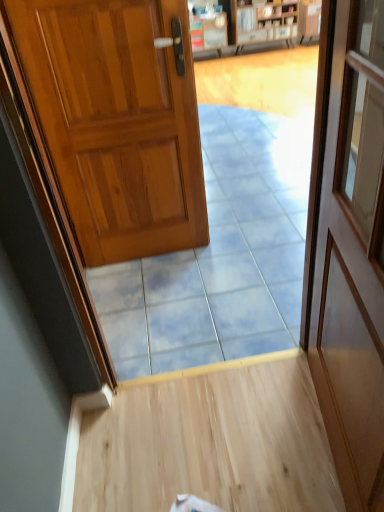
Question: Should I look upward or downward to see blue glossy tile at center?

Choices:
 (A) down
 (B) up

Answer: (A)

Question: Is wooden door at right, marked as the 2th door in a back-to-front arrangement, positioned far away from shiny wood door at left, positioned as the second door in right-to-left order?

Choices:
 (A) yes
 (B) no

Answer: (A)

Question: Does wooden door at right, the 2th door viewed from the left, have a smaller size compared to shiny wood door at left, positioned as the 1th door in back-to-front order?

Choices:
 (A) no
 (B) yes

Answer: (A)

Question: From a real-world perspective, is wooden door at right, marked as the 2th door in a back-to-front arrangement, located beneath shiny wood door at left, the first door viewed from the left?

Choices:
 (A) yes
 (B) no

Answer: (B)

Question: Considering the relative sizes of wooden door at right, which appears as the first door when viewed from the right, and shiny wood door at left, positioned as the second door in right-to-left order, in the image provided, is wooden door at right, which appears as the first door when viewed from the right, bigger than shiny wood door at left, positioned as the second door in right-to-left order,?

Choices:
 (A) no
 (B) yes

Answer: (B)

Question: Does wooden door at right, the 2th door viewed from the left, have a greater width compared to shiny wood door at left, the first door viewed from the left?

Choices:
 (A) no
 (B) yes

Answer: (A)

Question: From the image's perspective, is wooden door at right, the 1th door positioned from the front, located above shiny wood door at left, which is the second door in front-to-back order?

Choices:
 (A) no
 (B) yes

Answer: (A)

Question: Can you confirm if wooden door at right, the 2th door viewed from the left, is shorter than blue glossy tile at center?

Choices:
 (A) no
 (B) yes

Answer: (A)

Question: Is blue glossy tile at center at the back of wooden door at right, the 2th door viewed from the left?

Choices:
 (A) yes
 (B) no

Answer: (B)

Question: Does wooden door at right, the 1th door positioned from the front, have a greater width compared to blue glossy tile at center?

Choices:
 (A) no
 (B) yes

Answer: (A)

Question: Does wooden door at right, the 2th door viewed from the left, have a lesser width compared to blue glossy tile at center?

Choices:
 (A) no
 (B) yes

Answer: (B)

Question: Can we say wooden door at right, the 1th door positioned from the front, lies outside blue glossy tile at center?

Choices:
 (A) yes
 (B) no

Answer: (A)

Question: Does shiny wood door at left, positioned as the second door in right-to-left order, have a smaller size compared to wooden bookshelf at upper center?

Choices:
 (A) no
 (B) yes

Answer: (B)